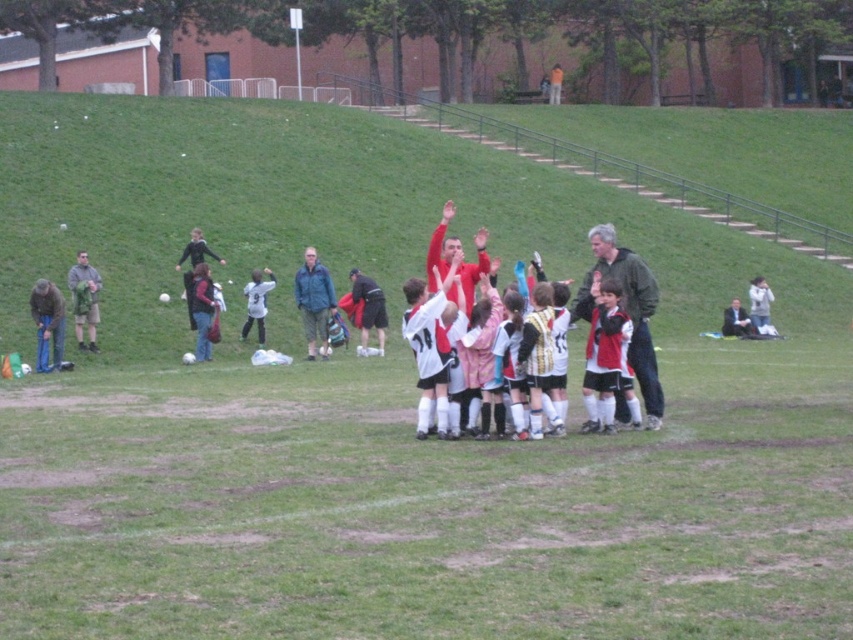
Describe the element at coordinates (84, 300) in the screenshot. The height and width of the screenshot is (640, 853). I see `green camouflage jacket at left` at that location.

How distant is green camouflage jacket at left from dark gray suit at lower right?

11.61 meters

Find the location of a particular element. This screenshot has height=640, width=853. green camouflage jacket at left is located at coordinates (84, 300).

I want to click on green camouflage jacket at left, so click(84, 300).

What do you see at coordinates (47, 323) in the screenshot? I see `matte gray jacket at left` at bounding box center [47, 323].

Can you confirm if matte gray jacket at left is positioned to the right of dark gray hoodie at center?

In fact, matte gray jacket at left is to the left of dark gray hoodie at center.

Between point (33, 282) and point (196, 312), which one is positioned behind?

Point (33, 282)

The width and height of the screenshot is (853, 640). Find the location of `matte gray jacket at left`. matte gray jacket at left is located at coordinates (47, 323).

Which is in front, point (314, 259) or point (383, 310)?

Point (314, 259)

Which is in front, point (325, 301) or point (384, 337)?

Positioned in front is point (325, 301).

Locate an element on the screen. blue fabric jacket at center is located at coordinates (314, 301).